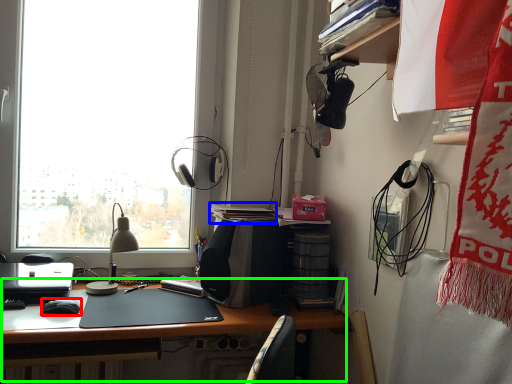
Question: Considering the real-world distances, which object is closest to mouse (highlighted by a red box)? book (highlighted by a blue box) or desk (highlighted by a green box).

Choices:
 (A) book
 (B) desk

Answer: (B)